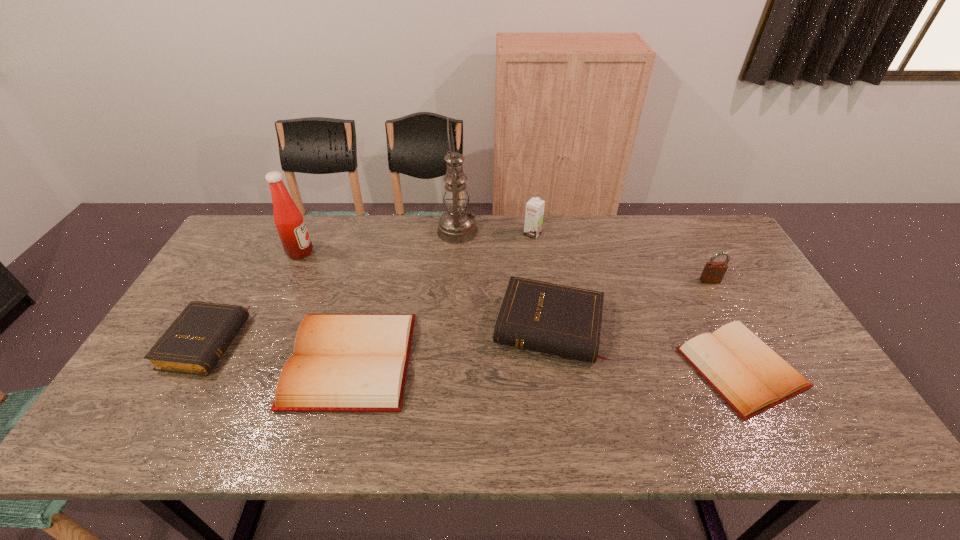
Where is `free space between the oil lamp and the leftmost Bible`? The height and width of the screenshot is (540, 960). free space between the oil lamp and the leftmost Bible is located at coordinates (331, 287).

You are a GUI agent. You are given a task and a screenshot of the screen. Output one action in this format:
    pyautogui.click(x=<x>, y=<y>)
    Task: Click on the free space that is in between the smaller gray Bible and the left red Bible
    
    Given the screenshot: What is the action you would take?
    pyautogui.click(x=278, y=352)

Locate an element on the screen. unoccupied area between the right gray Bible and the fourth tallest object is located at coordinates (629, 304).

Where is `free spot between the chocolate milk and the second tallest object`? The height and width of the screenshot is (540, 960). free spot between the chocolate milk and the second tallest object is located at coordinates tap(417, 243).

The height and width of the screenshot is (540, 960). What are the coordinates of `vacant region between the left red Bible and the right red Bible` in the screenshot? It's located at (546, 364).

Locate an element on the screen. the fourth closest object to the shortest Bible is located at coordinates (456, 226).

Choose which object is the second nearest neighbor to the seventh object from right to left. Please provide its 2D coordinates. Your answer should be formatted as a tuple, i.e. [(x, y)], where the tuple contains the x and y coordinates of a point satisfying the conditions above.

[(341, 362)]

Where is `Bible that is the second closest to the smaller gray Bible`? This screenshot has height=540, width=960. Bible that is the second closest to the smaller gray Bible is located at coordinates (560, 320).

You are a GUI agent. You are given a task and a screenshot of the screen. Output one action in this format:
    pyautogui.click(x=<x>, y=<y>)
    Task: Click on the Bible identified as the third closest to the second Bible from right to left
    This screenshot has width=960, height=540.
    Given the screenshot: What is the action you would take?
    pyautogui.click(x=194, y=343)

The height and width of the screenshot is (540, 960). What are the coordinates of `free spot that satisfies the following two spatial constraints: 1. on the front-facing side of the second object from left to right; 2. on the right side of the shortest object` in the screenshot? It's located at (247, 368).